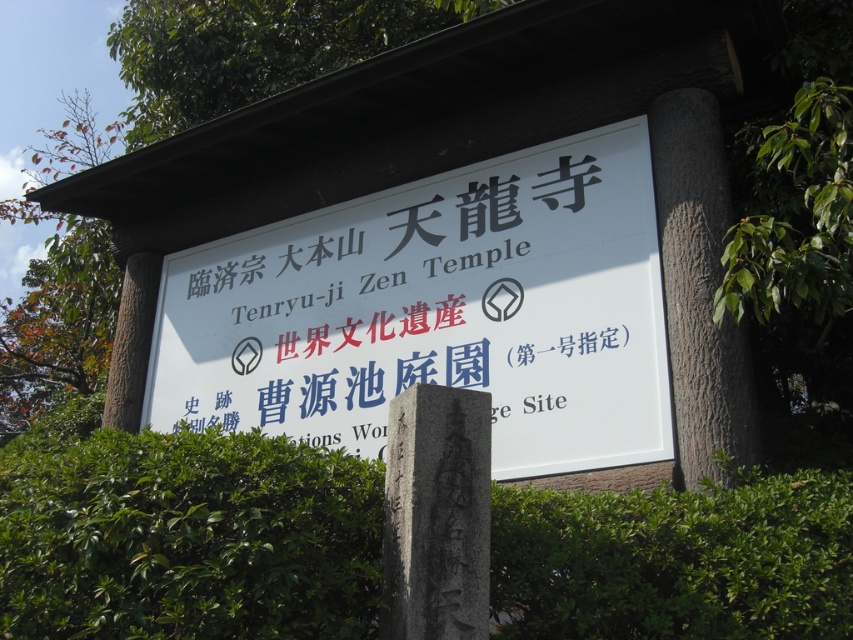
Question: Can you confirm if white paper sign at center is thinner than green leafy tree at upper center?

Choices:
 (A) yes
 (B) no

Answer: (A)

Question: Does green leafy hedge at center have a greater width compared to white paper sign at center?

Choices:
 (A) no
 (B) yes

Answer: (B)

Question: Estimate the real-world distances between objects in this image. Which object is closer to the green leafy tree at upper center?

Choices:
 (A) green leafy hedge at center
 (B) white paper sign at center

Answer: (B)

Question: Where is green leafy hedge at center located in relation to white paper sign at center in the image?

Choices:
 (A) left
 (B) right

Answer: (A)

Question: Among these objects, which one is farthest from the camera?

Choices:
 (A) green leafy hedge at center
 (B) white paper sign at center
 (C) green leafy tree at upper center

Answer: (C)

Question: Which object is closer to the camera taking this photo?

Choices:
 (A) green leafy hedge at center
 (B) green leafy tree at upper center
 (C) white paper sign at center

Answer: (A)